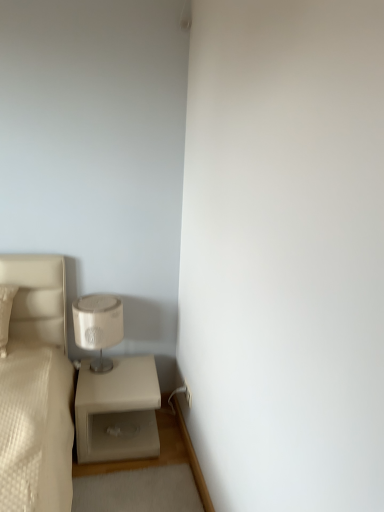
Question: From the image's perspective, is beige matte nightstand at lower left over matte beige lampshade at lower left?

Choices:
 (A) no
 (B) yes

Answer: (A)

Question: From a real-world perspective, does beige matte nightstand at lower left sit lower than matte beige lampshade at lower left?

Choices:
 (A) yes
 (B) no

Answer: (A)

Question: Considering the relative sizes of beige matte nightstand at lower left and matte beige lampshade at lower left in the image provided, is beige matte nightstand at lower left thinner than matte beige lampshade at lower left?

Choices:
 (A) yes
 (B) no

Answer: (B)

Question: From the image's perspective, is beige matte nightstand at lower left under matte beige lampshade at lower left?

Choices:
 (A) no
 (B) yes

Answer: (B)

Question: Is beige matte nightstand at lower left facing towards matte beige lampshade at lower left?

Choices:
 (A) yes
 (B) no

Answer: (B)

Question: Would you say beige matte nightstand at lower left contains matte beige lampshade at lower left?

Choices:
 (A) yes
 (B) no

Answer: (B)

Question: Is matte beige lampshade at lower left oriented away from beige matte nightstand at lower left?

Choices:
 (A) yes
 (B) no

Answer: (B)

Question: Does matte beige lampshade at lower left appear on the right side of beige matte nightstand at lower left?

Choices:
 (A) no
 (B) yes

Answer: (A)

Question: Are matte beige lampshade at lower left and beige matte nightstand at lower left far apart?

Choices:
 (A) no
 (B) yes

Answer: (A)

Question: Can we say matte beige lampshade at lower left lies outside beige matte nightstand at lower left?

Choices:
 (A) yes
 (B) no

Answer: (A)

Question: Is matte beige lampshade at lower left touching beige matte nightstand at lower left?

Choices:
 (A) yes
 (B) no

Answer: (B)

Question: Considering the relative sizes of matte beige lampshade at lower left and beige matte nightstand at lower left in the image provided, is matte beige lampshade at lower left wider than beige matte nightstand at lower left?

Choices:
 (A) no
 (B) yes

Answer: (A)

Question: From a real-world perspective, is matte beige lampshade at lower left positioned above or below beige matte nightstand at lower left?

Choices:
 (A) below
 (B) above

Answer: (B)